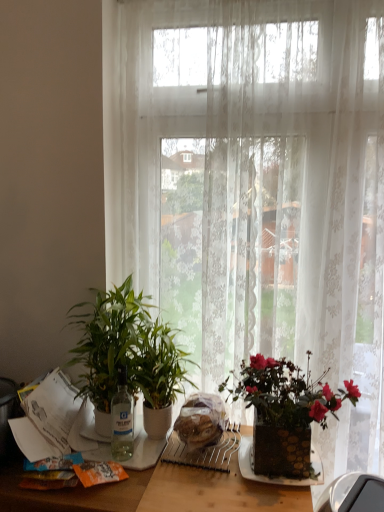
This screenshot has height=512, width=384. Find the location of `spots to the right of transparent glass bottle at center`. spots to the right of transparent glass bottle at center is located at coordinates (145, 458).